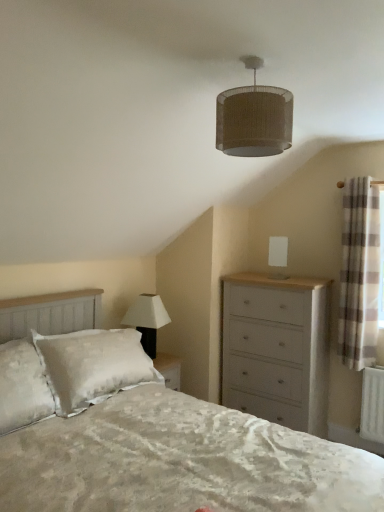
Identify the location of free space to the back side of white matte lampshade at upper center, the 1th lamp when ordered from right to left. The height and width of the screenshot is (512, 384). (280, 275).